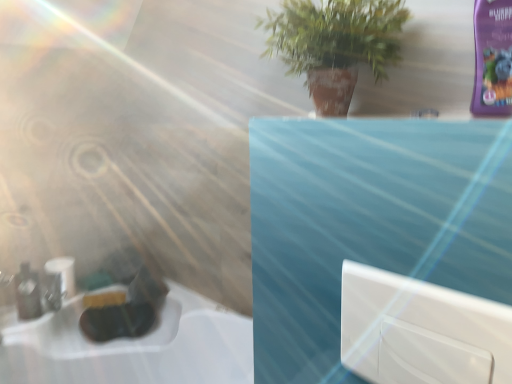
Question: Can you confirm if white glossy window at center is smaller than green matte plant at upper center?

Choices:
 (A) yes
 (B) no

Answer: (A)

Question: Is white glossy window at center located outside green matte plant at upper center?

Choices:
 (A) yes
 (B) no

Answer: (A)

Question: Does white glossy window at center have a lesser width compared to green matte plant at upper center?

Choices:
 (A) no
 (B) yes

Answer: (B)

Question: Is white glossy window at center oriented towards green matte plant at upper center?

Choices:
 (A) no
 (B) yes

Answer: (A)

Question: Is white glossy window at center positioned far away from green matte plant at upper center?

Choices:
 (A) no
 (B) yes

Answer: (A)

Question: Considering their positions, is white matte toilet paper at lower left located in front of or behind green matte plant at upper center?

Choices:
 (A) front
 (B) behind

Answer: (B)

Question: Based on their sizes in the image, would you say white matte toilet paper at lower left is bigger or smaller than green matte plant at upper center?

Choices:
 (A) small
 (B) big

Answer: (A)

Question: Do you think white matte toilet paper at lower left is within green matte plant at upper center, or outside of it?

Choices:
 (A) inside
 (B) outside

Answer: (B)

Question: From a real-world perspective, is white matte toilet paper at lower left physically located above or below green matte plant at upper center?

Choices:
 (A) below
 (B) above

Answer: (A)

Question: Is matte black bottle at left inside the boundaries of green matte plant at upper center, or outside?

Choices:
 (A) outside
 (B) inside

Answer: (A)

Question: Based on their sizes in the image, would you say matte black bottle at left is bigger or smaller than green matte plant at upper center?

Choices:
 (A) big
 (B) small

Answer: (B)

Question: From a real-world perspective, relative to green matte plant at upper center, is matte black bottle at left vertically above or below?

Choices:
 (A) below
 (B) above

Answer: (A)

Question: Visually, is matte black bottle at left positioned to the left or to the right of green matte plant at upper center?

Choices:
 (A) left
 (B) right

Answer: (A)

Question: From the image's perspective, is matte black bottle at left above or below white matte toilet paper at lower left?

Choices:
 (A) below
 (B) above

Answer: (A)

Question: Considering the positions of matte black bottle at left and white matte toilet paper at lower left in the image, is matte black bottle at left taller or shorter than white matte toilet paper at lower left?

Choices:
 (A) short
 (B) tall

Answer: (B)